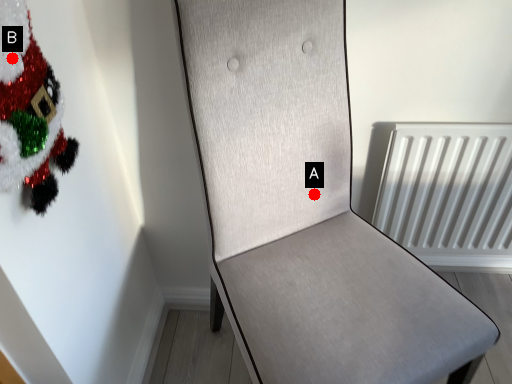
Question: Two points are circled on the image, labeled by A and B beside each circle. Among these points, which one is nearest to the camera?

Choices:
 (A) A is closer
 (B) B is closer

Answer: (B)